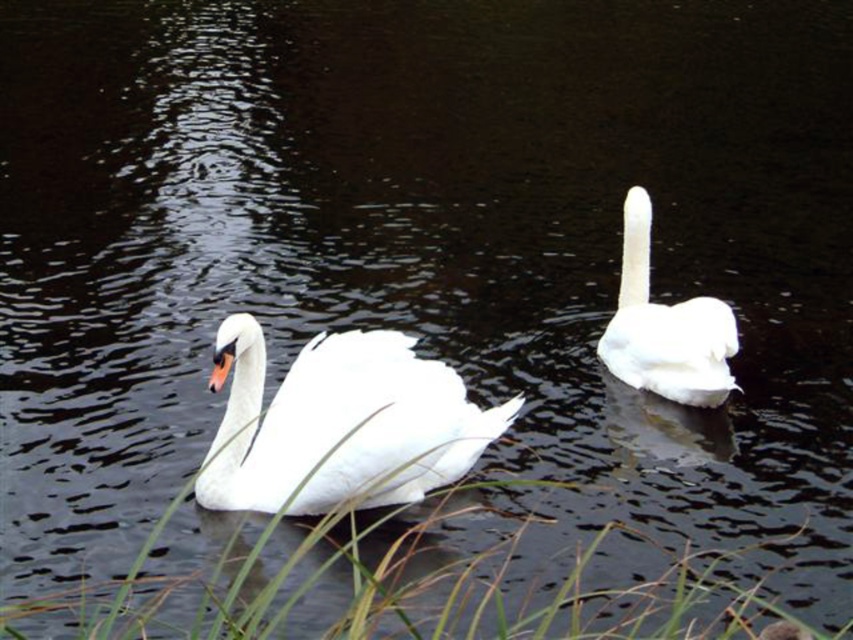
You are standing on a pier and want to take a photo of the white glossy swan at center. If your camera has a maximum focus range of 4 meters, will you be able to focus on the swan?

The white glossy swan at center and camera are 4.47 meters apart from each other. Since the camera can only focus up to 4 meters, you won

You are observing two swans in the water. The white glossy swan at center and the white feathered swan at right. Which one is nearer to you?

The white glossy swan at center is closer to the viewer than the white feathered swan at right.